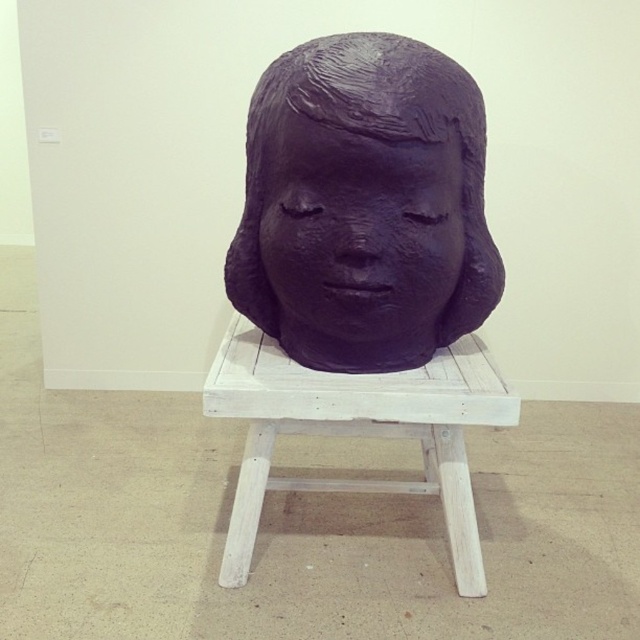
Question: Considering the relative positions of purple matte head at center and white wood stool at center in the image provided, where is purple matte head at center located with respect to white wood stool at center?

Choices:
 (A) below
 (B) above

Answer: (B)

Question: Which of these objects is positioned closest to the white wood stool at center?

Choices:
 (A) purple matte head at center
 (B) purple matte sculpture at center

Answer: (A)

Question: Considering the real-world distances, which object is closest to the white wood stool at center?

Choices:
 (A) purple matte head at center
 (B) purple matte sculpture at center

Answer: (A)

Question: Which of the following is the farthest from the observer?

Choices:
 (A) purple matte sculpture at center
 (B) purple matte head at center
 (C) white wood stool at center

Answer: (C)

Question: Can you confirm if purple matte sculpture at center is bigger than white wood stool at center?

Choices:
 (A) no
 (B) yes

Answer: (A)

Question: Does purple matte head at center appear over white wood stool at center?

Choices:
 (A) no
 (B) yes

Answer: (B)